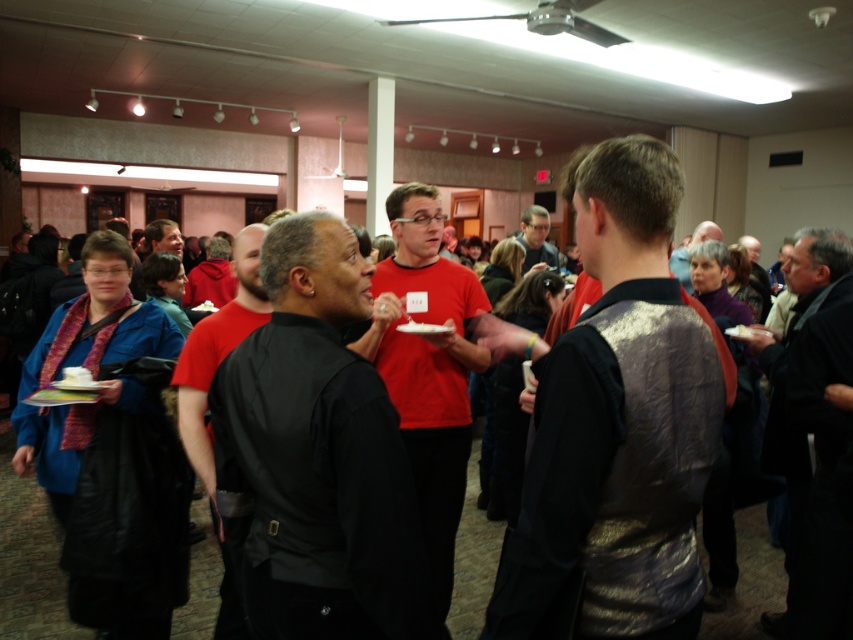
You are a photographer at the event and want to capture a photo of both the shiny metallic vest at center and the black leather jacket at right. Since you can only focus on one object at a time, which one should you focus on first if you want to keep both in the frame without moving the camera?

You should focus on the shiny metallic vest at center first because it is to the left of the black leather jacket at right, so by focusing on the leftmost object, you can ensure both remain in the frame.